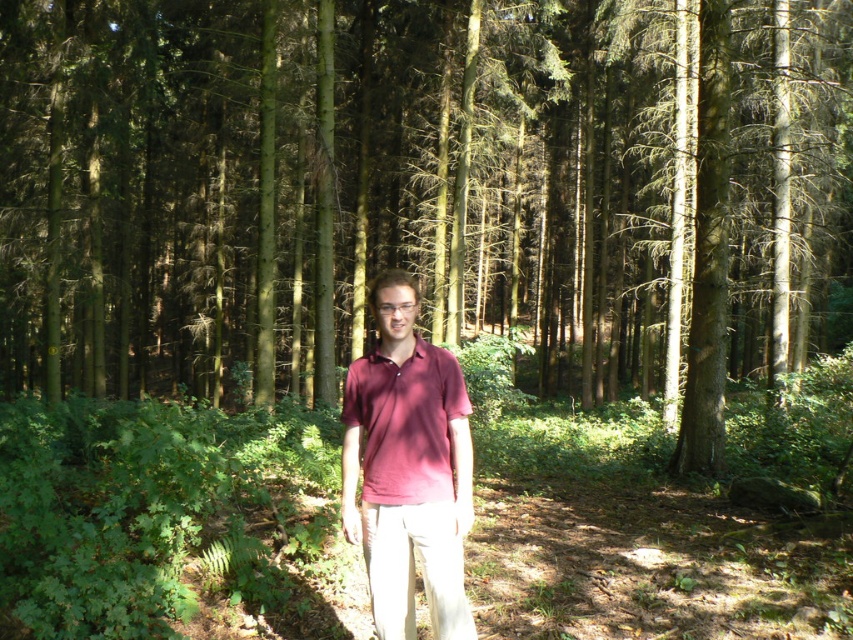
Question: Which point appears farthest from the camera in this image?

Choices:
 (A) (386, 195)
 (B) (405, 301)

Answer: (A)

Question: Which object appears closest to the camera in this image?

Choices:
 (A) green matte tree at center
 (B) matte red shirt at center
 (C) maroon cotton shirt at center

Answer: (C)

Question: Is maroon cotton shirt at center below matte red shirt at center?

Choices:
 (A) no
 (B) yes

Answer: (B)

Question: Is green matte tree at center smaller than maroon cotton shirt at center?

Choices:
 (A) yes
 (B) no

Answer: (B)

Question: Which point appears farthest from the camera in this image?

Choices:
 (A) (13, 77)
 (B) (456, 369)

Answer: (A)

Question: Observing the image, what is the correct spatial positioning of maroon cotton shirt at center in reference to matte red shirt at center?

Choices:
 (A) left
 (B) right

Answer: (A)